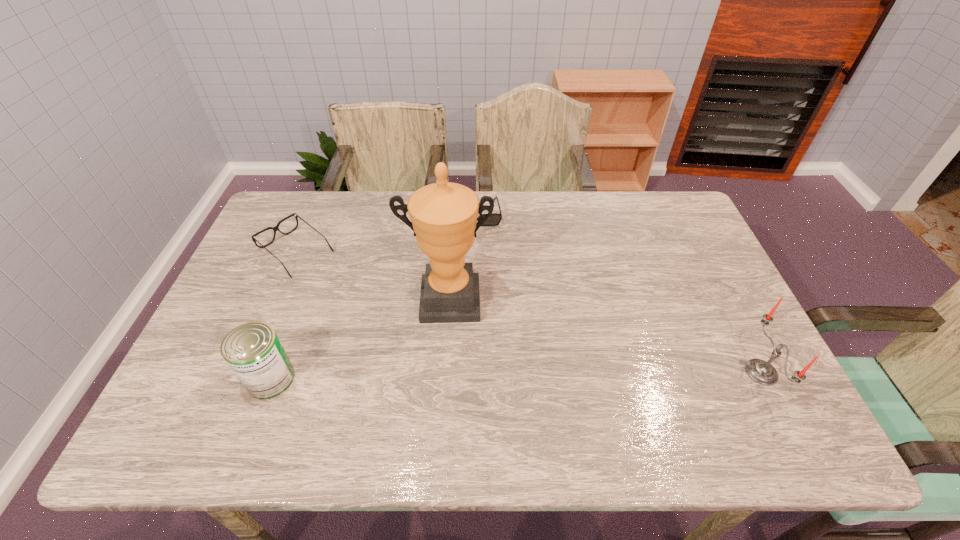
You are a GUI agent. You are given a task and a screenshot of the screen. Output one action in this format:
    pyautogui.click(x=<x>, y=<y>)
    Task: Click on the free space that satisfies the following two spatial constraints: 1. on the back side of the can; 2. on the front-facing side of the rightmost object
    Image resolution: width=960 pixels, height=540 pixels.
    Given the screenshot: What is the action you would take?
    pyautogui.click(x=273, y=372)

Where is `vacant space that satisfies the following two spatial constraints: 1. on the front side of the tallest object; 2. on the front-facing side of the fourth shortest object`? This screenshot has height=540, width=960. vacant space that satisfies the following two spatial constraints: 1. on the front side of the tallest object; 2. on the front-facing side of the fourth shortest object is located at coordinates (444, 372).